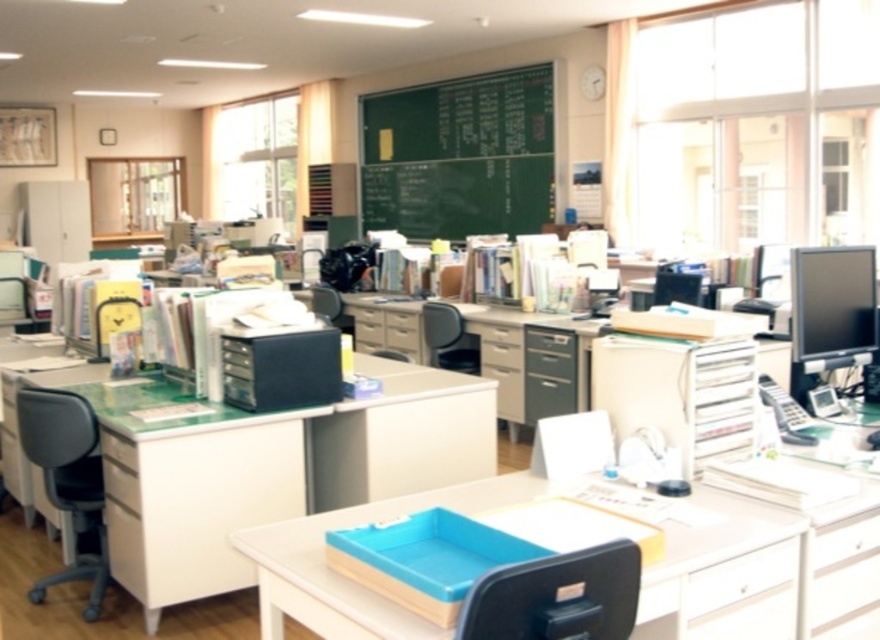
You are a student who needs to sit down and work on your laptop. You see the gray fabric swivel chair at left and the white plastic drawer at lower left. Which object should you choose to sit on?

You should choose the gray fabric swivel chair at left to sit on because it is taller than the white plastic drawer at lower left, making it more suitable for sitting.

You are a student who needs to organize your desk. You have a matte plastic tray at center and a white glossy drawer at center. Which object should you place your pens in to keep them closer to you while working?

The matte plastic tray at center is in front of the white glossy drawer at center, so placing the pens in the matte plastic tray at center will keep them closer to you while working.